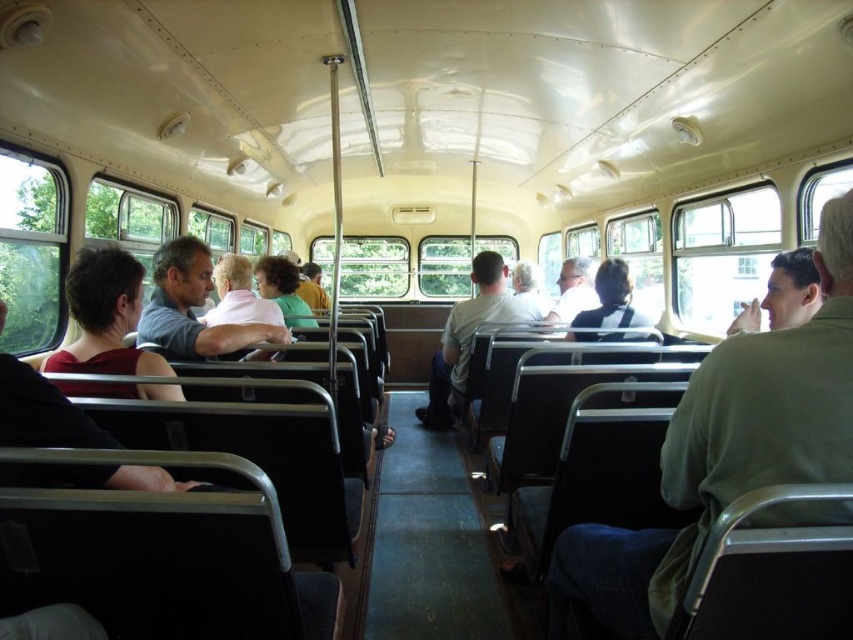
From the picture: Is green matte shirt at right to the left of light gray shirt at center from the viewer's perspective?

Correct, you'll find green matte shirt at right to the left of light gray shirt at center.

In the scene shown: Which is more to the left, green matte shirt at right or light gray shirt at center?

green matte shirt at right

Which is in front, point (631, 609) or point (582, 282)?

Positioned in front is point (631, 609).

This screenshot has height=640, width=853. In order to click on green matte shirt at right in this screenshot , I will do `click(726, 451)`.

This screenshot has width=853, height=640. I want to click on green matte shirt at right, so click(x=726, y=451).

Locate an element on the screen. The width and height of the screenshot is (853, 640). green matte shirt at right is located at coordinates (726, 451).

Does light gray fabric shirt at center have a lesser width compared to curly-haired person at center?

No.

Can you confirm if light gray fabric shirt at center is positioned to the right of curly-haired person at center?

Indeed, light gray fabric shirt at center is positioned on the right side of curly-haired person at center.

Which is behind, point (422, 413) or point (292, 262)?

Positioned behind is point (422, 413).

The width and height of the screenshot is (853, 640). I want to click on light gray fabric shirt at center, so click(469, 333).